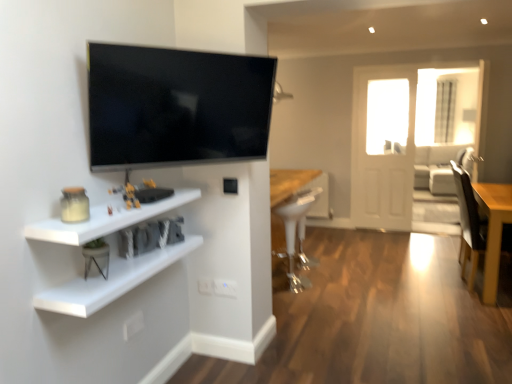
Question: Can you confirm if light brown wooden table at right is wider than white matte shelf at lower left, which ranks as the 2th shelf in top-to-bottom order?

Choices:
 (A) yes
 (B) no

Answer: (A)

Question: Is light brown wooden table at right to the right of white matte shelf at lower left, which ranks as the 2th shelf in top-to-bottom order, from the viewer's perspective?

Choices:
 (A) no
 (B) yes

Answer: (B)

Question: Are light brown wooden table at right and white matte shelf at lower left, which ranks as the 2th shelf in top-to-bottom order, located far from each other?

Choices:
 (A) yes
 (B) no

Answer: (A)

Question: Is light brown wooden table at right at the left side of white matte shelf at lower left, acting as the 1th shelf starting from the bottom?

Choices:
 (A) no
 (B) yes

Answer: (A)

Question: From the image's perspective, is light brown wooden table at right beneath white matte shelf at lower left, acting as the 1th shelf starting from the bottom?

Choices:
 (A) no
 (B) yes

Answer: (B)

Question: Do you think white matte shelf at lower left, which is counted as the 1th shelf, starting from the top, is within matte black tv at upper left, or outside of it?

Choices:
 (A) outside
 (B) inside

Answer: (A)

Question: From the image's perspective, relative to matte black tv at upper left, is white matte shelf at lower left, which is counted as the 1th shelf, starting from the top, above or below?

Choices:
 (A) below
 (B) above

Answer: (A)

Question: Does point (114, 223) appear closer or farther from the camera than point (268, 102)?

Choices:
 (A) farther
 (B) closer

Answer: (B)

Question: Is white matte shelf at lower left, the second shelf in the bottom-to-top sequence, bigger or smaller than matte black tv at upper left?

Choices:
 (A) big
 (B) small

Answer: (B)

Question: Do you think white glossy stool at center is within white matte shelf at lower left, the second shelf in the bottom-to-top sequence, or outside of it?

Choices:
 (A) inside
 (B) outside

Answer: (B)

Question: Does point (288, 273) appear closer or farther from the camera than point (200, 195)?

Choices:
 (A) farther
 (B) closer

Answer: (A)

Question: In terms of height, does white glossy stool at center look taller or shorter compared to white matte shelf at lower left, which is counted as the 1th shelf, starting from the top?

Choices:
 (A) short
 (B) tall

Answer: (B)

Question: In the image, is white glossy stool at center on the left side or the right side of white matte shelf at lower left, which is counted as the 1th shelf, starting from the top?

Choices:
 (A) right
 (B) left

Answer: (A)

Question: Is matte black tv at upper left to the left or to the right of white glossy stool at center in the image?

Choices:
 (A) right
 (B) left

Answer: (B)

Question: From the image's perspective, relative to white glossy stool at center, is matte black tv at upper left above or below?

Choices:
 (A) below
 (B) above

Answer: (B)